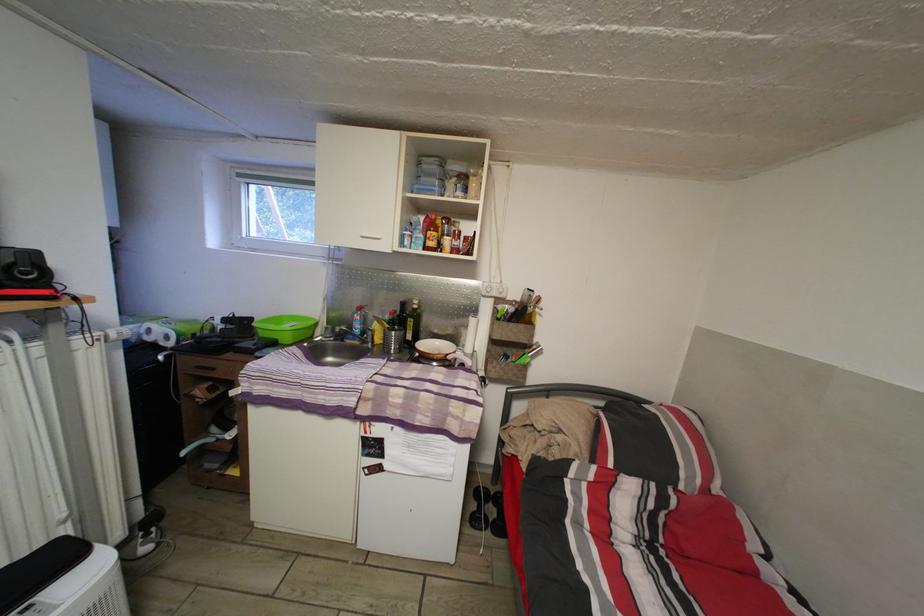
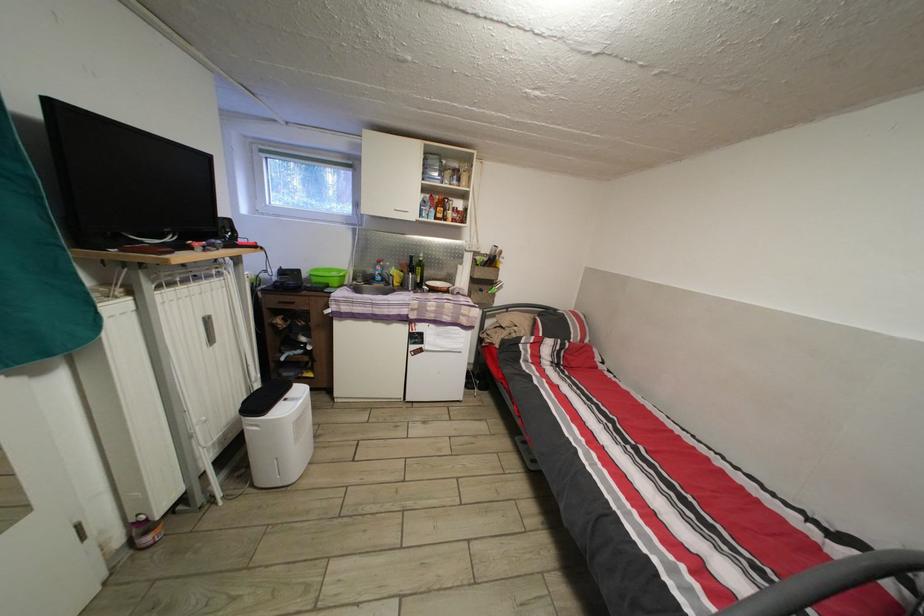
Where in the second image is the point corresponding to [377,339] from the first image?

(398, 285)